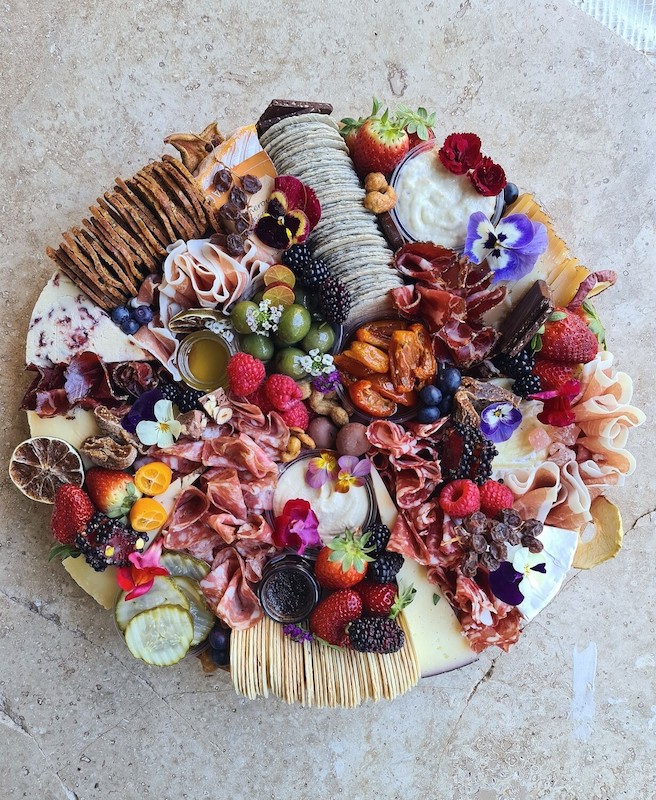
Locate an element on the screen. cement table is located at coordinates (567, 88).